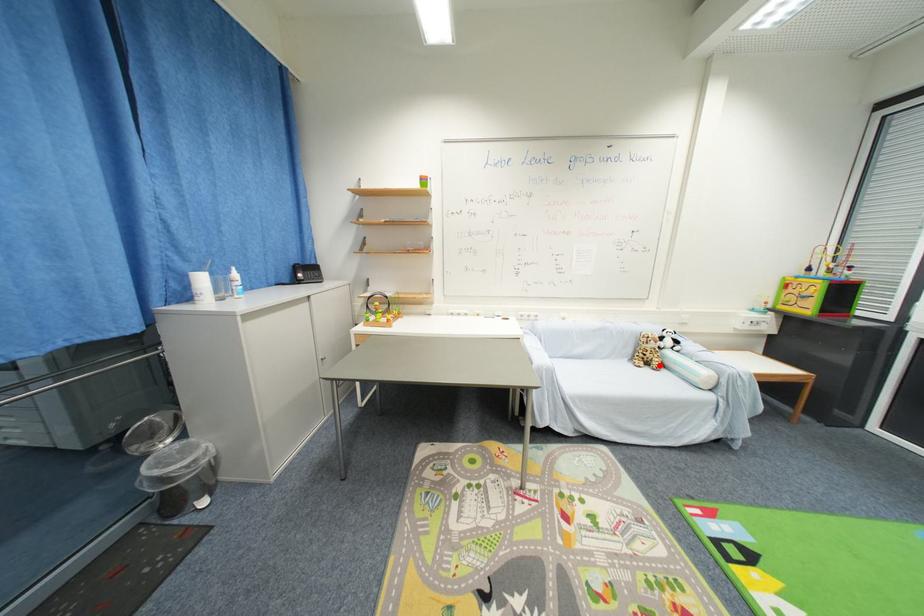
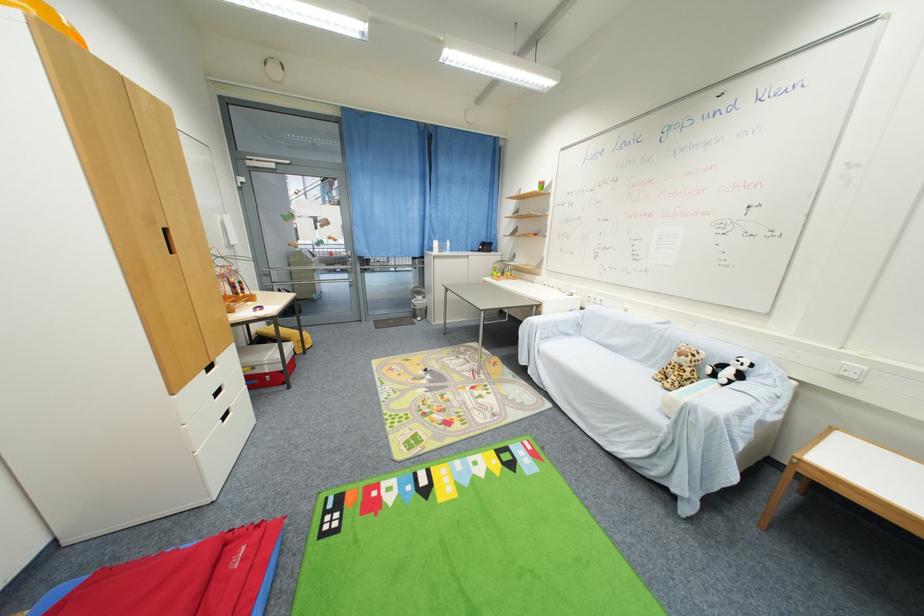
The point at the highlighted location is marked in the first image. Where is the corresponding point in the second image?

(675, 382)